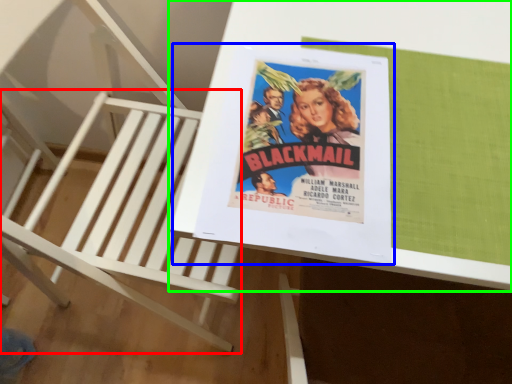
Question: Based on their relative distances, which object is farther from furniture (highlighted by a red box)? Choose from paperback book (highlighted by a blue box) and table (highlighted by a green box).

Choices:
 (A) paperback book
 (B) table

Answer: (A)